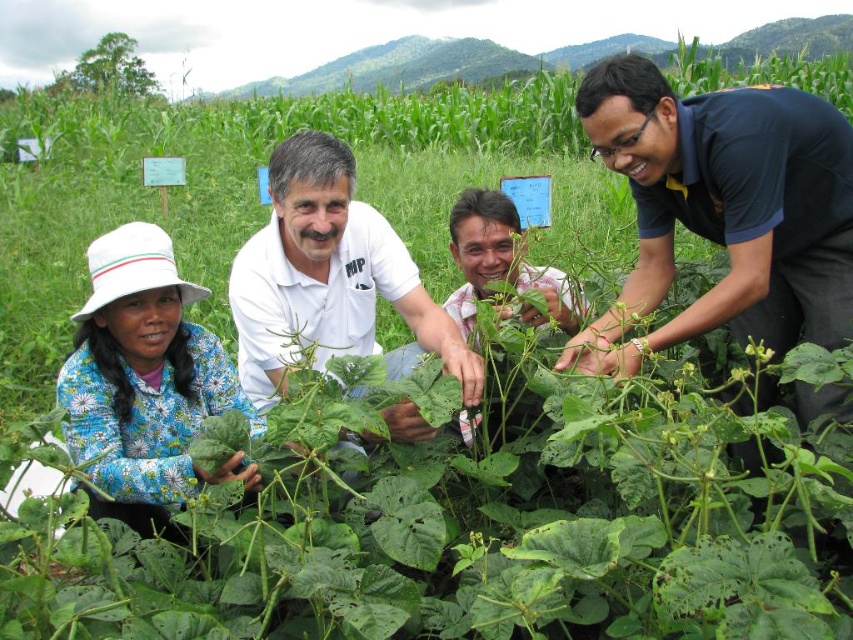
Question: Which of these objects is positioned farthest from the dark blue shirt at center?

Choices:
 (A) white cotton shirt at center
 (B) blue floral dress at lower left

Answer: (B)

Question: Considering the relative positions of blue floral dress at lower left and white cotton shirt at center in the image provided, where is blue floral dress at lower left located with respect to white cotton shirt at center?

Choices:
 (A) left
 (B) right

Answer: (A)

Question: Does blue floral dress at lower left lie behind white cotton shirt at center?

Choices:
 (A) yes
 (B) no

Answer: (B)

Question: Among these objects, which one is farthest from the camera?

Choices:
 (A) white cotton shirt at center
 (B) blue floral dress at lower left

Answer: (A)

Question: Does dark blue shirt at center appear over blue floral dress at lower left?

Choices:
 (A) yes
 (B) no

Answer: (A)

Question: Among these objects, which one is nearest to the camera?

Choices:
 (A) blue floral dress at lower left
 (B) dark blue shirt at center
 (C) white cotton shirt at center

Answer: (A)